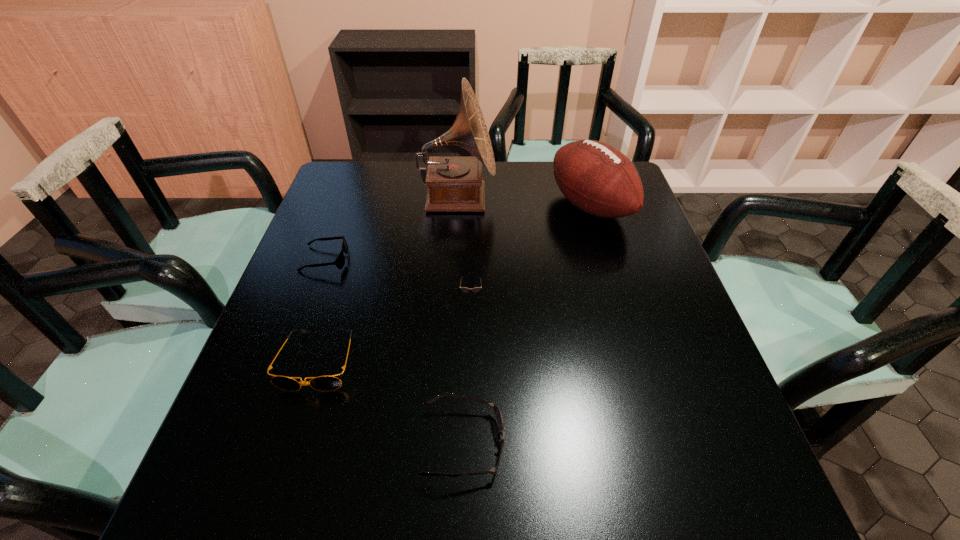
In the image, there is a desktop. Identify the location of vacant space at the near edge. This screenshot has width=960, height=540. (637, 507).

This screenshot has height=540, width=960. In order to click on free space at the left edge of the desktop in this screenshot , I will do `click(322, 287)`.

Find the location of a particular element. This screenshot has width=960, height=540. vacant area at the right edge of the desktop is located at coordinates (623, 256).

Where is `vacant region at the far left corner`? This screenshot has width=960, height=540. vacant region at the far left corner is located at coordinates (356, 186).

Image resolution: width=960 pixels, height=540 pixels. I want to click on empty space between the fourth farthest object and the nearest sunglasses, so tap(468, 369).

This screenshot has height=540, width=960. What are the coordinates of `free area in between the third nearest object and the phonograph record` in the screenshot? It's located at (465, 247).

Where is `vacant area that lies between the third nearest sunglasses and the nearest sunglasses`? This screenshot has height=540, width=960. vacant area that lies between the third nearest sunglasses and the nearest sunglasses is located at coordinates (468, 369).

Where is `free spot between the nearest object and the farthest sunglasses`? The height and width of the screenshot is (540, 960). free spot between the nearest object and the farthest sunglasses is located at coordinates (395, 351).

At what (x,y) coordinates should I click in order to perform the action: click on vacant region between the fourth farthest object and the football (American). Please return your answer as a coordinate pair (x, y). Looking at the image, I should click on (531, 251).

Where is `vacant area between the second farthest sunglasses and the nearest object`? Image resolution: width=960 pixels, height=540 pixels. vacant area between the second farthest sunglasses and the nearest object is located at coordinates (468, 369).